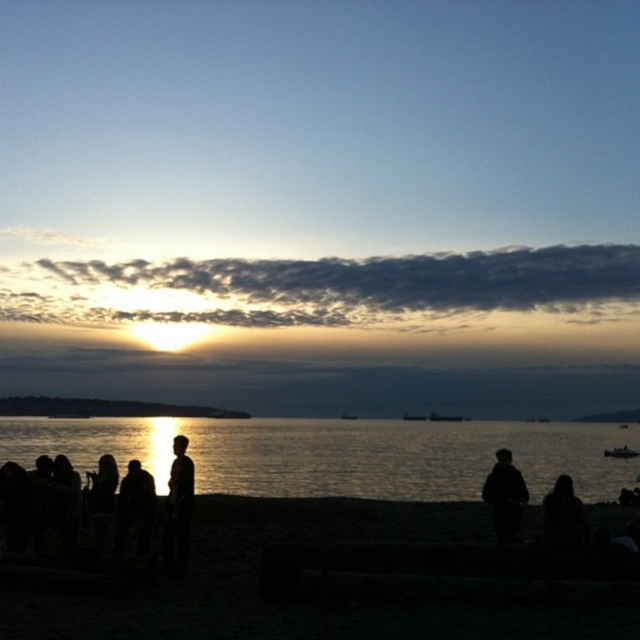
You are standing on the beach and see the dark matte jacket at center. Where exactly is it located in terms of coordinates?

The dark matte jacket at center is located at coordinates point (504, 497).

Based on the photo, you are standing on the beach and see the silhouette figure at lower right and the metallic silver boat at lower right. Which object is closer to you?

The silhouette figure at lower right is closer to you because it is in front of the metallic silver boat at lower right.

You are a photographer trying to capture the sunset with the dark matte jacket at center and the silhouette figure at center in your shot. Which object should you place closer to the right edge of your camera frame?

The dark matte jacket at center should be placed closer to the right edge of your camera frame because it is positioned on the right side of the silhouette figure at center.